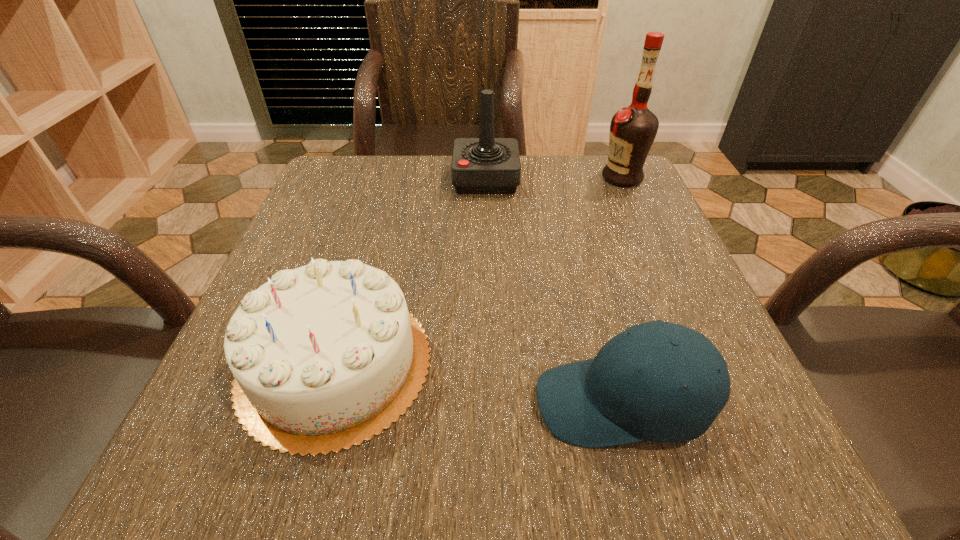
The height and width of the screenshot is (540, 960). Identify the location of free spot at the far right corner of the desktop. (605, 196).

In the image, there is a desktop. At what (x,y) coordinates should I click in order to perform the action: click on vacant space at the near right corner. Please return your answer as a coordinate pair (x, y). The height and width of the screenshot is (540, 960). Looking at the image, I should click on (786, 482).

The image size is (960, 540). What are the coordinates of `vacant space in between the liquor and the shortest object` in the screenshot? It's located at coord(621,290).

Identify the location of free area in between the shortest object and the second shortest object. The image size is (960, 540). [478, 383].

Image resolution: width=960 pixels, height=540 pixels. Find the location of `free point between the joystick and the shortest object`. free point between the joystick and the shortest object is located at coordinates (553, 291).

Locate an element on the screen. This screenshot has height=540, width=960. vacant space in between the liquor and the birthday cake is located at coordinates (478, 270).

Find the location of a particular element. This screenshot has height=540, width=960. vacant area that lies between the tallest object and the third shortest object is located at coordinates (554, 178).

This screenshot has width=960, height=540. I want to click on empty location between the liquor and the third tallest object, so click(478, 270).

Locate an element on the screen. The image size is (960, 540). free space between the liquor and the second shortest object is located at coordinates (478, 270).

At what (x,y) coordinates should I click in order to perform the action: click on empty space between the tallest object and the joystick. Please return your answer as a coordinate pair (x, y). Image resolution: width=960 pixels, height=540 pixels. Looking at the image, I should click on (554, 178).